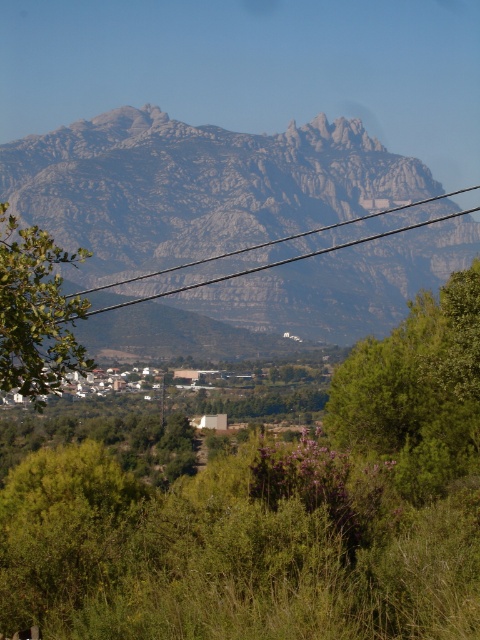
Question: Is green leafy tree at lower left further to the viewer compared to black wire at upper center?

Choices:
 (A) no
 (B) yes

Answer: (A)

Question: Among these points, which one is farthest from the camera?

Choices:
 (A) (415, 445)
 (B) (321, 250)
 (C) (17, 346)

Answer: (B)

Question: Which is nearer to the black wire at upper center?

Choices:
 (A) green leafy tree at center
 (B) green leafy tree at lower left

Answer: (A)

Question: Is green leafy tree at center positioned before black wire at upper center?

Choices:
 (A) yes
 (B) no

Answer: (B)

Question: Which point is closer to the camera taking this photo?

Choices:
 (A) (31, 253)
 (B) (468, 468)

Answer: (A)

Question: Is green leafy tree at center wider than black wire at upper center?

Choices:
 (A) yes
 (B) no

Answer: (B)